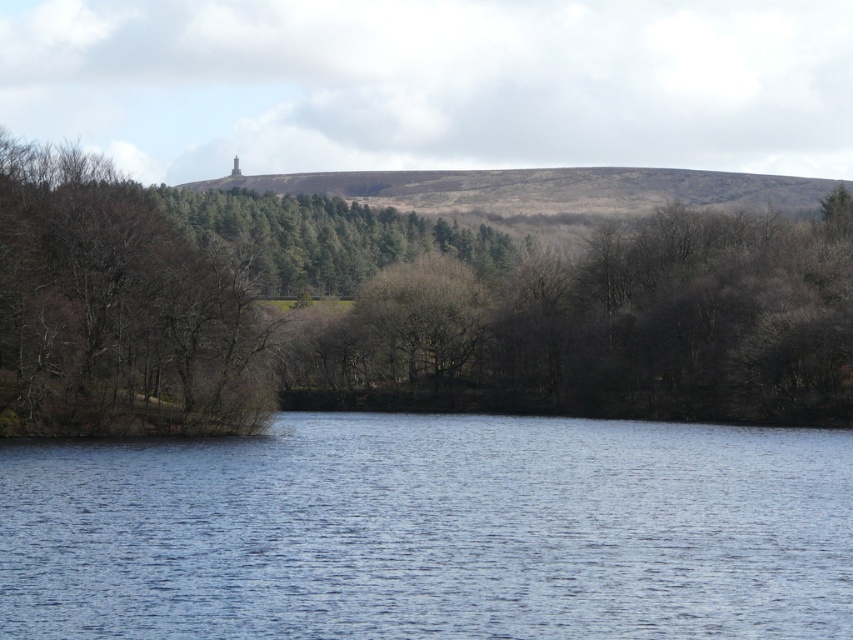
You are standing on the dock and want to compare the sizes of the brown leafless tree at center and the blue water at lower center. Which one appears bigger in the image?

The brown leafless tree at center has a larger size compared to the blue water at lower center, so it appears bigger.